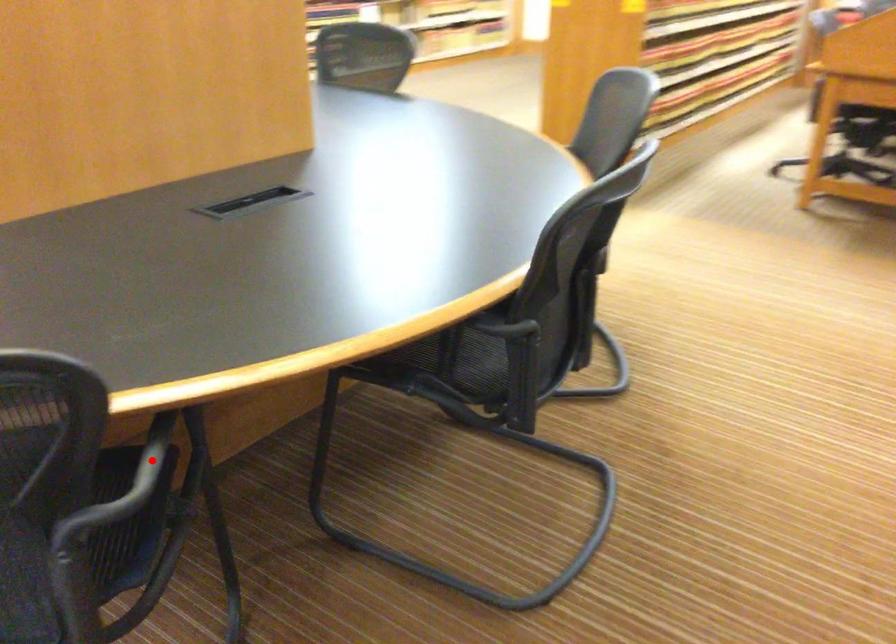
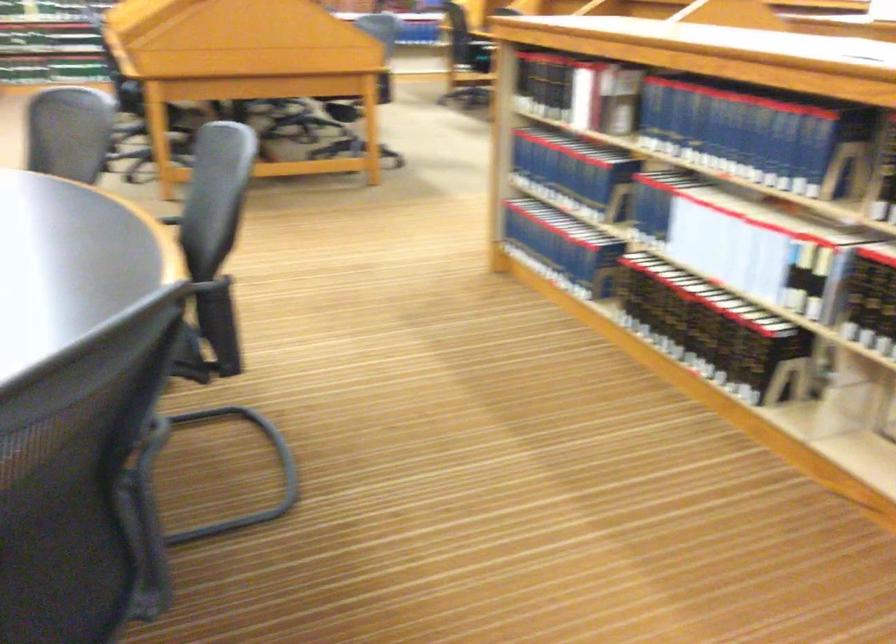
Question: I am providing you with two images of the same scene from different viewpoints. A red point is marked on the first image. At the location where the point appears in image 1, is it still visible in image 2?

Choices:
 (A) Yes
 (B) No

Answer: (B)